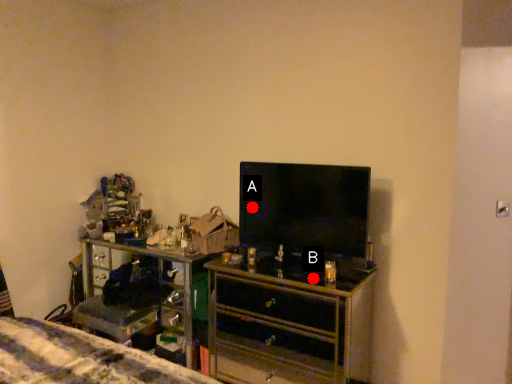
Question: Two points are circled on the image, labeled by A and B beside each circle. Which of the following is the farthest from the observer?

Choices:
 (A) A is further
 (B) B is further

Answer: (A)